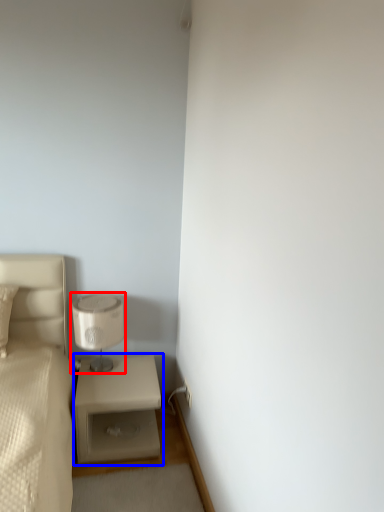
Question: Which object is closer to the camera taking this photo, table lamp (highlighted by a red box) or nightstand (highlighted by a blue box)?

Choices:
 (A) table lamp
 (B) nightstand

Answer: (B)